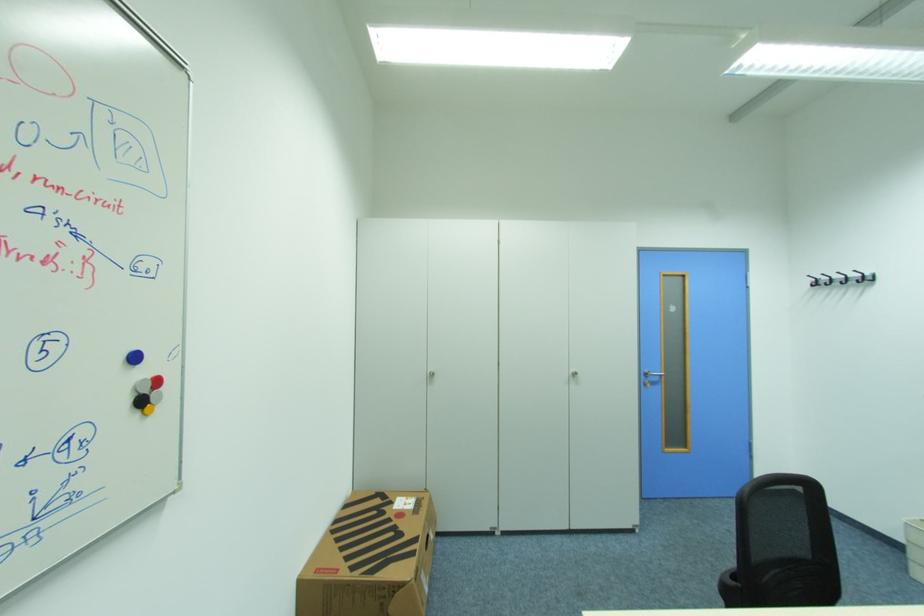
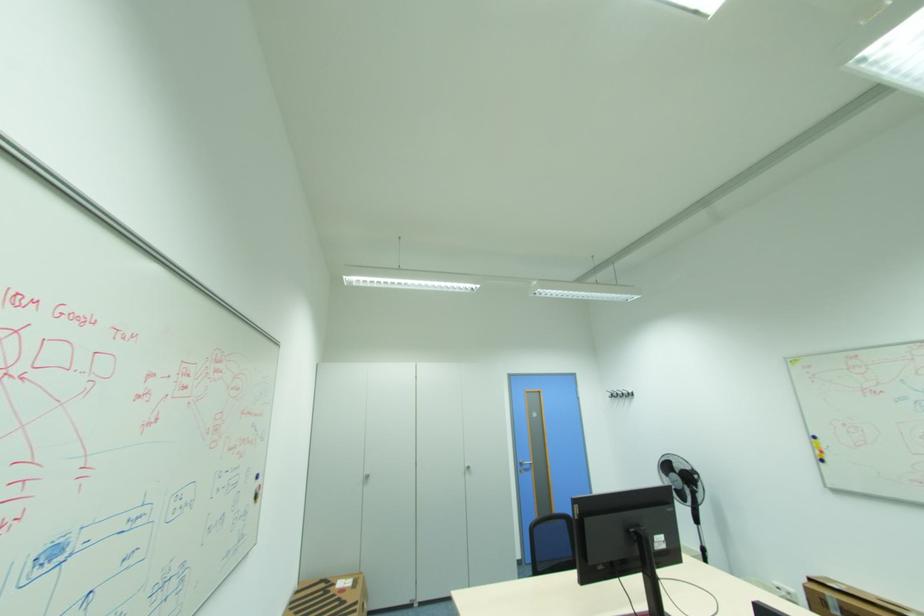
Find the pixel in the second image that matches pixel 396 503 in the first image.

(338, 585)